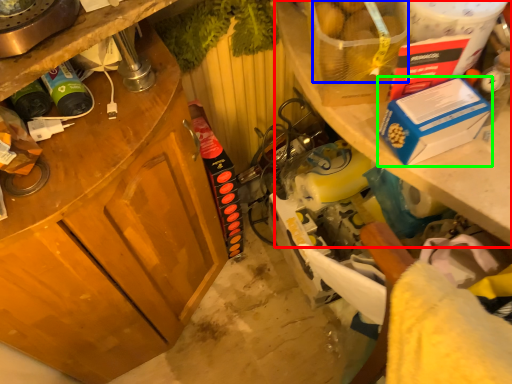
Question: Considering the real-world distances, which object is farthest from shelf (highlighted by a red box)? food (highlighted by a blue box) or box (highlighted by a green box)?

Choices:
 (A) food
 (B) box

Answer: (A)